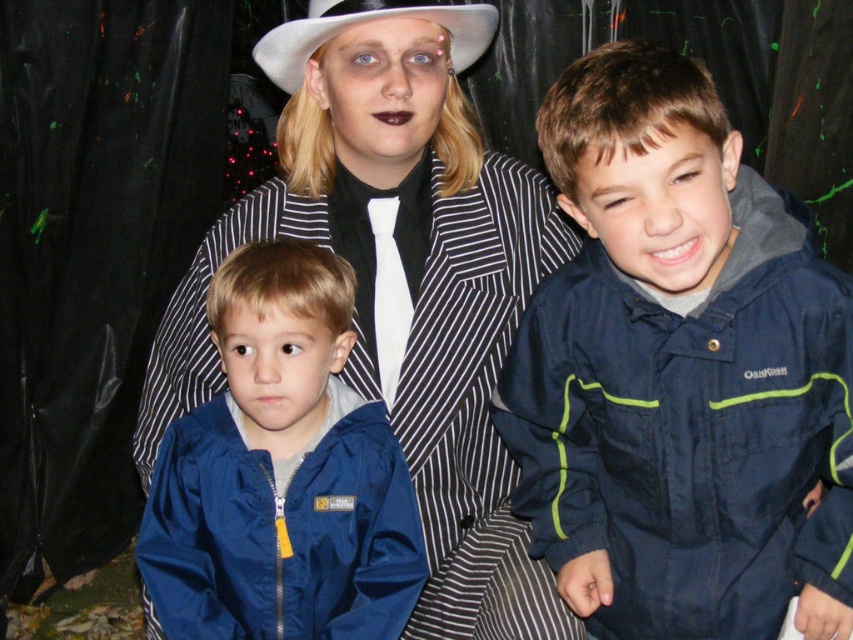
You are a photographer who needs to adjust the lighting for a photo shoot. You have two jackets in the scene, the navy blue jacket at center and the matte blue jacket at lower left. Which jacket should you focus your spotlight on to ensure it is illuminated properly given their positions?

The navy blue jacket at center is closer to the viewer than the matte blue jacket at lower left, so you should focus the spotlight on the navy blue jacket at center to ensure it is illuminated properly.

You are a photographer setting up for a group photo. The two jackets, navy blue jacket at center and matte blue jacket at lower left, are 43.33 centimeters apart. If your camera has a minimum focus distance of 40 centimeters, will you be able to capture both jackets clearly in the photo?

The navy blue jacket at center and matte blue jacket at lower left are 43.33 centimeters apart, which is greater than the camera minimum focus distance of 40 centimeters. Therefore, both jackets can be captured clearly in the photo.

You are a photographer setting up a photo shoot with a camera that has a minimum focus distance of 25 inches. You need to ensure that both the navy blue jacket at center and the white felt cowboy hat at upper center are in focus. Can you position the camera so that both objects are within the focus range?

The navy blue jacket at center and white felt cowboy hat at upper center are 27.73 inches apart. Since the minimum focus distance is 25 inches, the camera can be positioned to include both objects within the focus range as the distance between them is slightly beyond the minimum requirement.